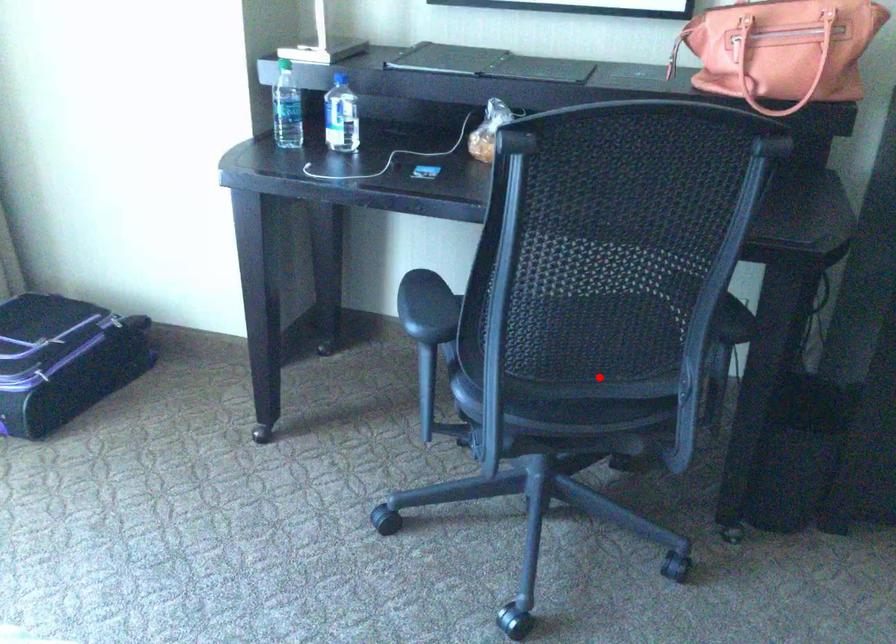
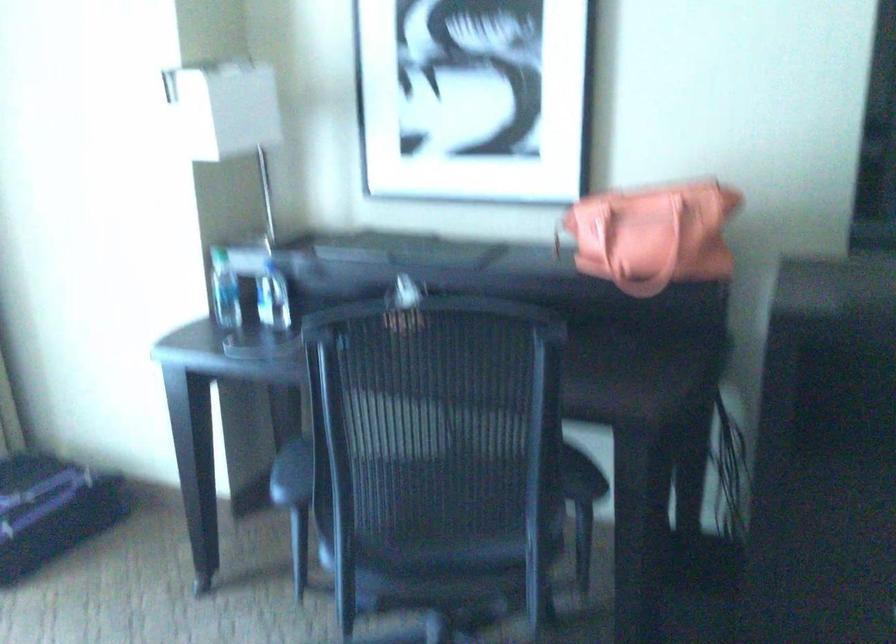
In the second image, find the point that corresponds to the highlighted location in the first image.

(458, 544)